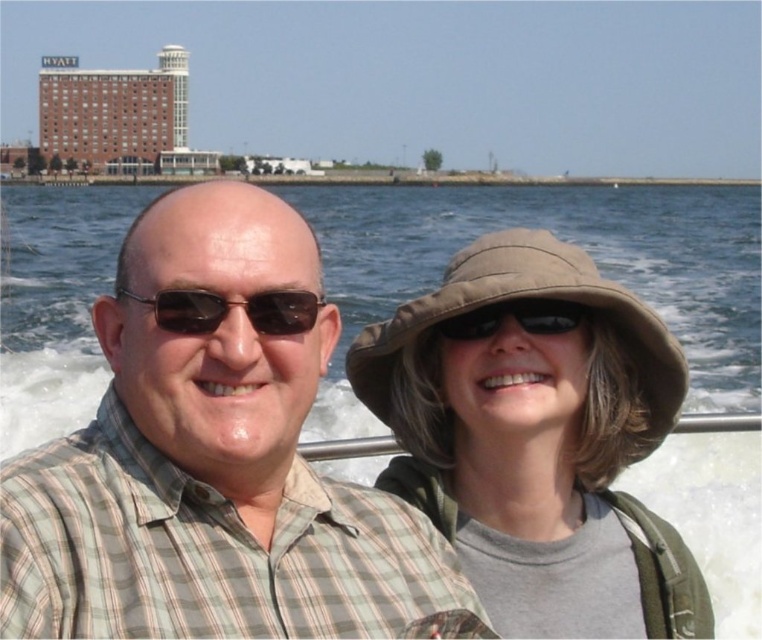
Does brown fabric hat at center appear over clear blue water at center?

No, brown fabric hat at center is not above clear blue water at center.

Is point (572, 448) in front of point (354, 273)?

Yes, point (572, 448) is closer to viewer.

Is point (376, 480) in front of point (34, 390)?

Yes, it is in front of point (34, 390).

You are a GUI agent. You are given a task and a screenshot of the screen. Output one action in this format:
    pyautogui.click(x=<x>, y=<y>)
    Task: Click on the brown fabric hat at center
    The image size is (762, 640).
    Given the screenshot: What is the action you would take?
    pyautogui.click(x=536, y=436)

How much distance is there between brown fabric hat at center and matte black goggles at upper center?

They are 16.03 feet apart.

Who is more distant from viewer, [386,394] or [474,328]?

Positioned behind is point [386,394].

Where is `brown fabric hat at center`? brown fabric hat at center is located at coordinates (536, 436).

What do you see at coordinates (210, 458) in the screenshot?
I see `checkered fabric shirt at center` at bounding box center [210, 458].

Does checkered fabric shirt at center appear under matte black sunglasses at center?

Correct, checkered fabric shirt at center is located below matte black sunglasses at center.

Which is in front, point (391, 548) or point (175, 296)?

Point (175, 296) is in front.

Find the location of a particular element. This screenshot has width=762, height=640. checkered fabric shirt at center is located at coordinates (210, 458).